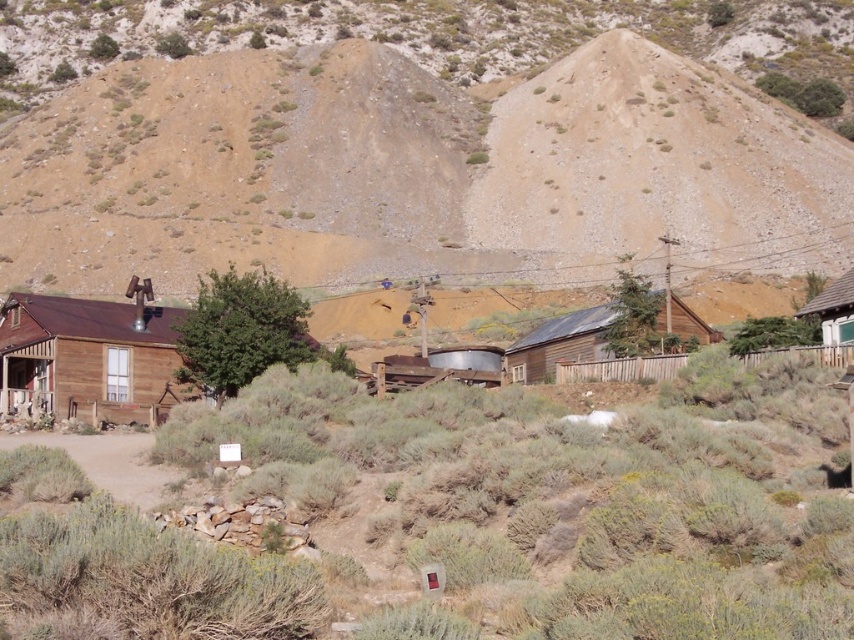
Between brown wooden hut at center and wooden hut at right, which one has less height?

Standing shorter between the two is brown wooden hut at center.

Is brown wooden hut at center taller than wooden hut at right?

No.

At what (x,y) coordinates should I click in order to perform the action: click on brown wooden hut at center. Please return your answer as a coordinate pair (x, y). This screenshot has height=640, width=854. Looking at the image, I should click on (560, 342).

Identify the location of brown wooden hut at center. This screenshot has height=640, width=854. pyautogui.click(x=560, y=342).

Does brown wooden hut at left appear over green leafy bush at upper right?

No, brown wooden hut at left is not above green leafy bush at upper right.

Between point (165, 342) and point (768, 84), which one is positioned in front?

Point (165, 342) is in front.

What do you see at coordinates (88, 356) in the screenshot? This screenshot has width=854, height=640. I see `brown wooden hut at left` at bounding box center [88, 356].

The width and height of the screenshot is (854, 640). In order to click on brown wooden hut at left in this screenshot , I will do `click(88, 356)`.

Does green leafy tree at center have a greater height compared to wooden hut at right?

Yes, green leafy tree at center is taller than wooden hut at right.

Which is more to the right, green leafy tree at center or wooden hut at right?

wooden hut at right

Which is in front, point (230, 296) or point (838, 307)?

Point (838, 307)

Find the location of a particular element. green leafy tree at center is located at coordinates (240, 332).